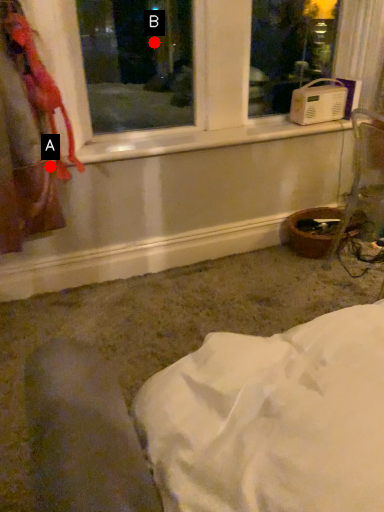
Question: Two points are circled on the image, labeled by A and B beside each circle. Which of the following is the closest to the observer?

Choices:
 (A) A is closer
 (B) B is closer

Answer: (A)